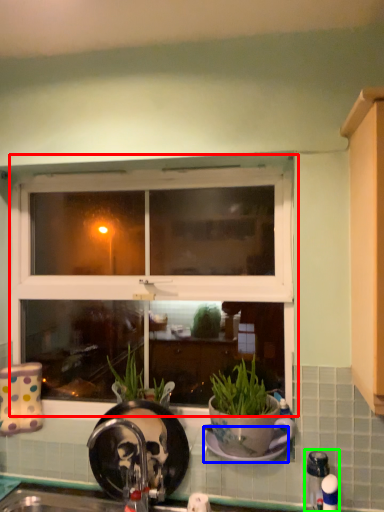
Question: Considering the real-world distances, which object is farthest from window (highlighted by a red box)? plate (highlighted by a blue box) or faucet (highlighted by a green box)?

Choices:
 (A) plate
 (B) faucet

Answer: (B)